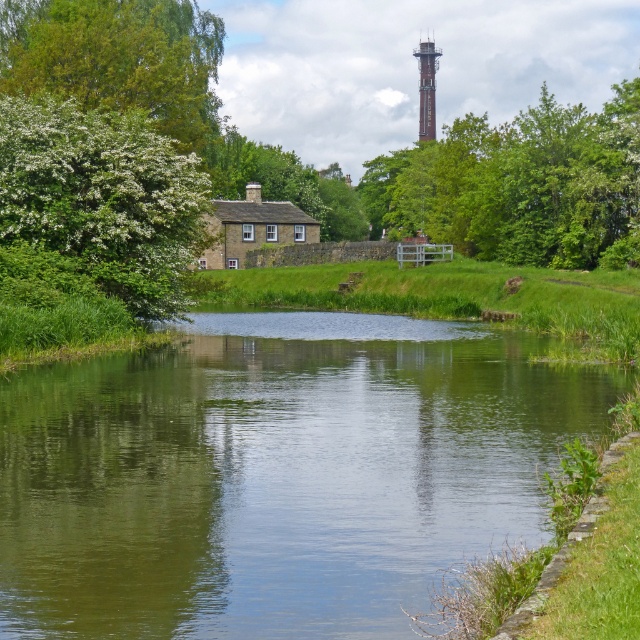
In the scene shown: Which is below, green smooth water at center or green leafy tree at upper center?

green smooth water at center

Can you confirm if green smooth water at center is taller than green leafy tree at upper center?

In fact, green smooth water at center may be shorter than green leafy tree at upper center.

Between point (468, 440) and point (497, 193), which one is positioned in front?

Point (468, 440) is more forward.

At what (x,y) coordinates should I click in order to perform the action: click on green smooth water at center. Please return your answer as a coordinate pair (x, y). Image resolution: width=640 pixels, height=640 pixels. Looking at the image, I should click on (276, 474).

Does white blossoming bush at left appear over brick tower at upper center?

No, white blossoming bush at left is not above brick tower at upper center.

Locate an element on the screen. The image size is (640, 640). white blossoming bush at left is located at coordinates (102, 196).

The image size is (640, 640). What are the coordinates of `white blossoming bush at left` in the screenshot? It's located at (102, 196).

Does point (461, 218) come behind point (429, 45)?

That is False.

In the scene shown: Can you confirm if green leafy tree at upper center is shorter than brick tower at upper center?

Incorrect, green leafy tree at upper center's height does not fall short of brick tower at upper center's.

Is point (564, 266) positioned before point (435, 134)?

Yes, point (564, 266) is in front of point (435, 134).

Identify the location of green leafy tree at upper center. (520, 184).